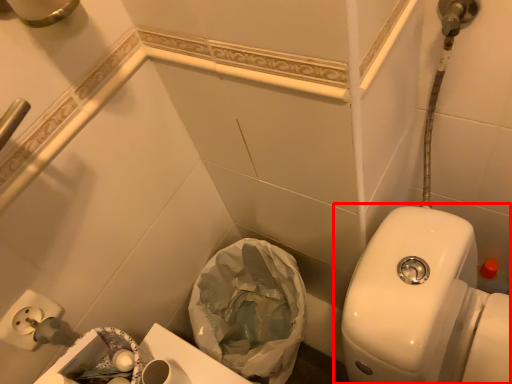
Question: From the image's perspective, where is toilet (annotated by the red box) located in relation to garbage in the image?

Choices:
 (A) above
 (B) below

Answer: (A)